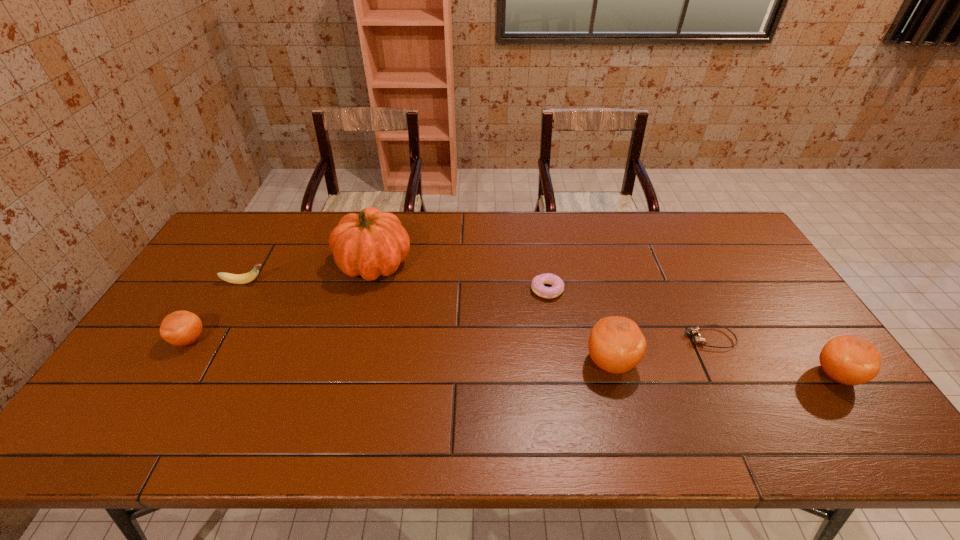
Please point a spot to place another orange_(fruit) for symmetrical spacing. Please provide its 2D coordinates. Your answer should be formatted as a tuple, i.e. [(x, y)], where the tuple contains the x and y coordinates of a point satisfying the conditions above.

[(396, 351)]